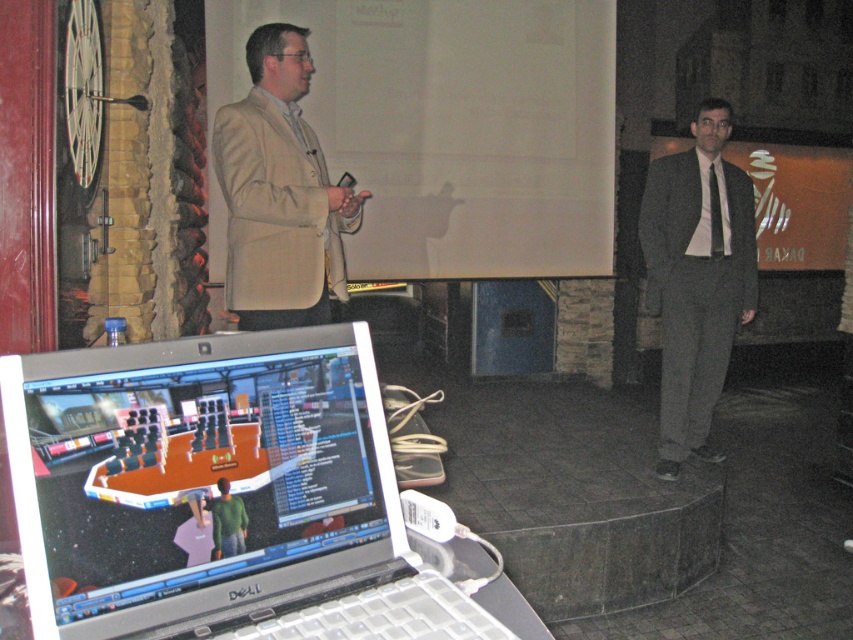
You are an event organizer setting up a presentation. You have to decide whether the white matte projection screen at upper center will fit in the space allocated for it, which is the same width as the beige fabric suit at upper left. Based on the scene, will the screen fit?

The white matte projection screen at upper center is wider than the beige fabric suit at upper left, so it will not fit in the allocated space.

You are an event organizer planning to set up a presentation. You have a white matte projection screen at upper center and a beige fabric suit at upper left. Which object should you adjust the projector focus on first if you want to ensure both are visible clearly?

The white matte projection screen at upper center is bigger than the beige fabric suit at upper left, so you should adjust the projector focus on the white matte projection screen at upper center first to ensure clarity for the larger object before adjusting for the smaller one.

Based on the photo, you are standing in the room where the presentation is happening. You need to move from the laptop displaying the video game interface to the raised platform where the two individuals are standing. Which of the two points, point (67, 518) or point (380, 278), would you encounter first as you walk towards the platform?

You would encounter point (67, 518) first because it is in front of point (380, 278), meaning it is closer to your starting position at the laptop.